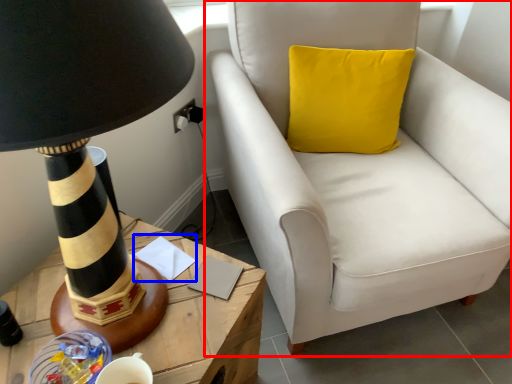
Question: Among these objects, which one is farthest to the camera, chair (highlighted by a red box) or notepad (highlighted by a blue box)?

Choices:
 (A) chair
 (B) notepad

Answer: (B)